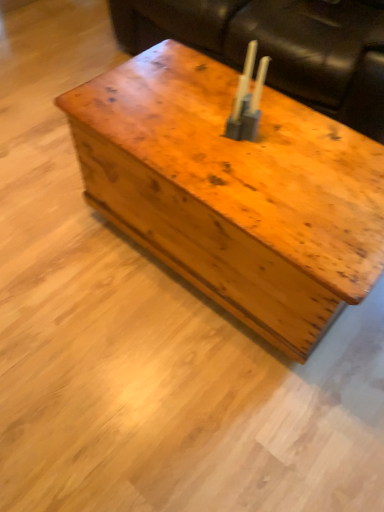
The height and width of the screenshot is (512, 384). I want to click on blank space situated above wooden trunk at center (from a real-world perspective), so click(x=240, y=141).